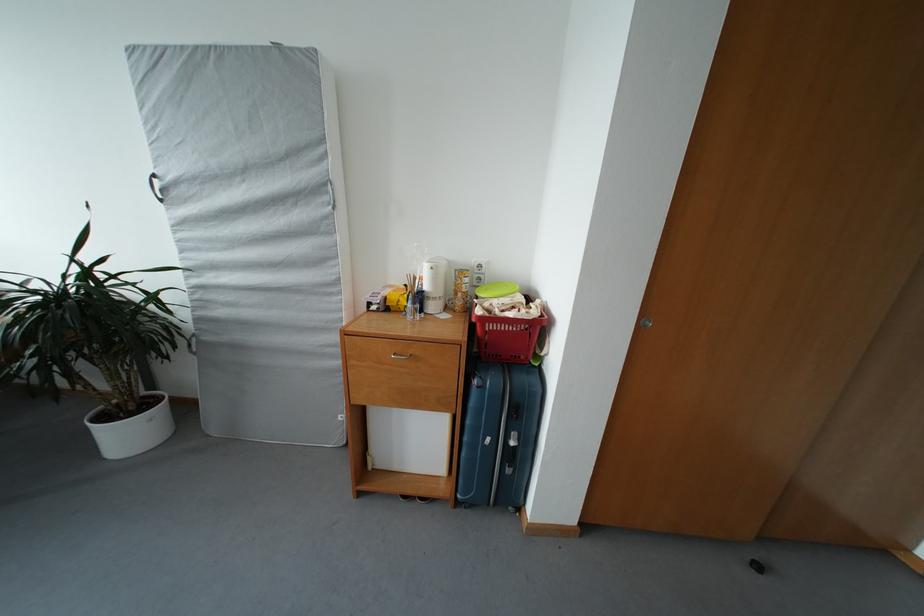
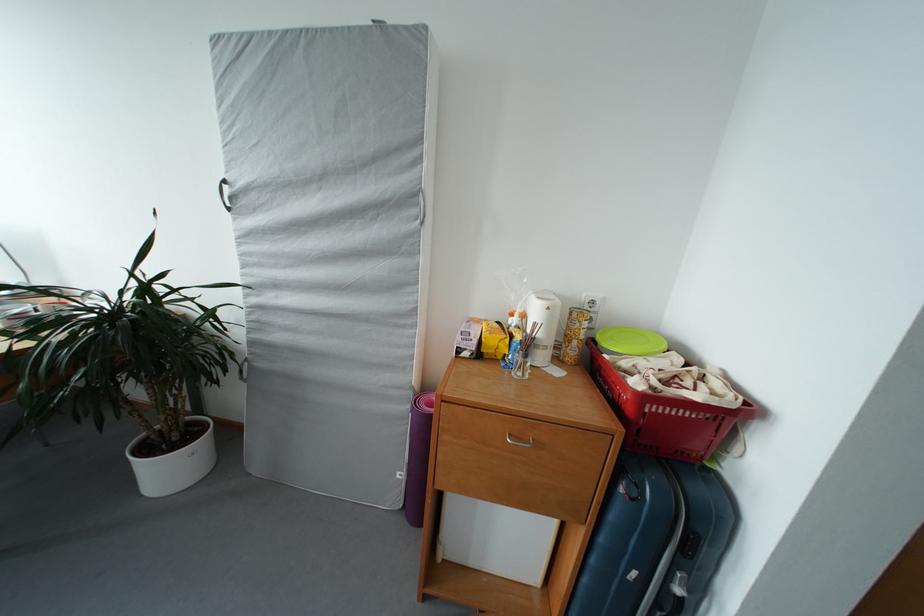
Question: The images are taken continuously from a first-person perspective. In which direction is your viewpoint rotating?

Choices:
 (A) Left
 (B) Right
 (C) Up
 (D) Down

Answer: (A)